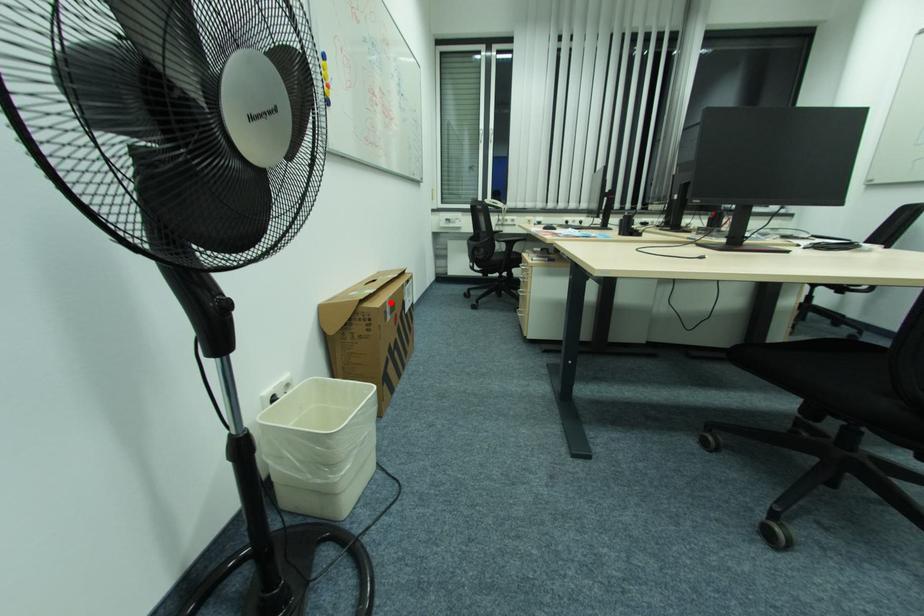
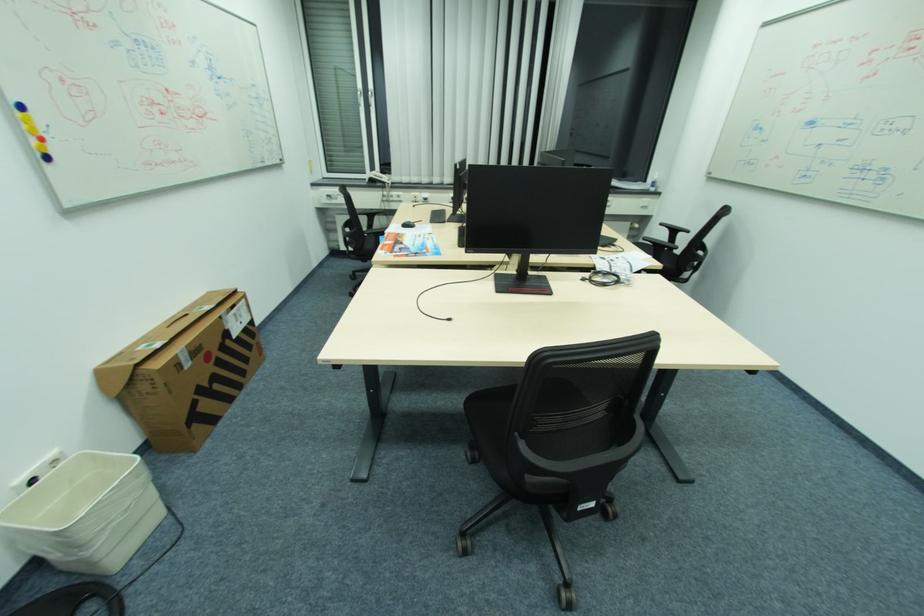
Question: I am providing you with two images of the same scene from different viewpoints. In image1, a red point is highlighted. Considering the same 3D point in image2, which of the following is correct?

Choices:
 (A) It is closer
 (B) It is farther

Answer: (B)